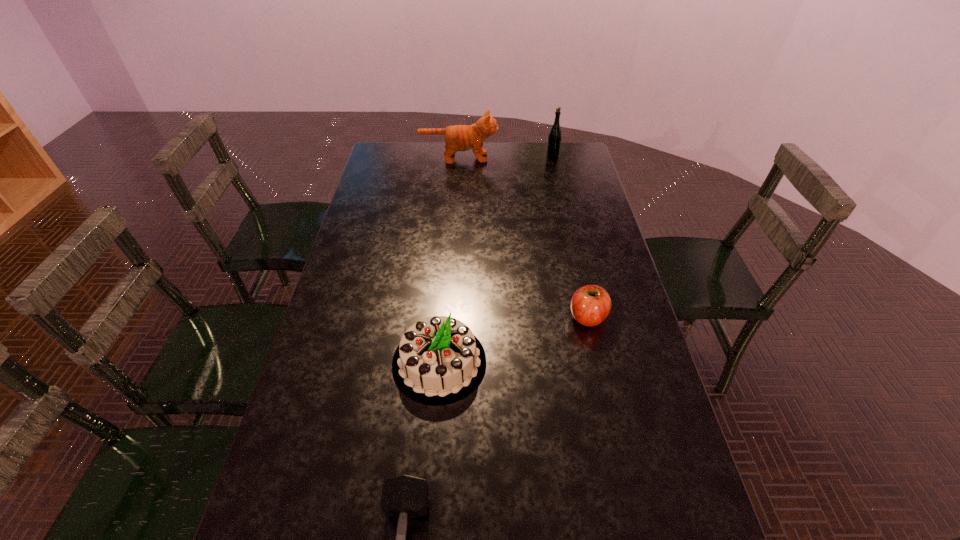
Find the location of a particular element. free space between the apple and the cat is located at coordinates (523, 238).

This screenshot has height=540, width=960. Identify the location of vacant point located between the cat and the birthday cake. (x=449, y=260).

In order to click on free spot between the beer bottle and the third tallest object in this screenshot , I will do `click(496, 259)`.

Locate which object is the third closest to the cat. Please provide its 2D coordinates. Your answer should be formatted as a tuple, i.e. [(x, y)], where the tuple contains the x and y coordinates of a point satisfying the conditions above.

[(439, 360)]

This screenshot has width=960, height=540. What are the coordinates of `the third closest object to the nearest object` in the screenshot? It's located at (457, 137).

Where is `free space that satisfies the following two spatial constraints: 1. on the back side of the third shortest object; 2. on the right side of the apple`? free space that satisfies the following two spatial constraints: 1. on the back side of the third shortest object; 2. on the right side of the apple is located at coordinates (443, 317).